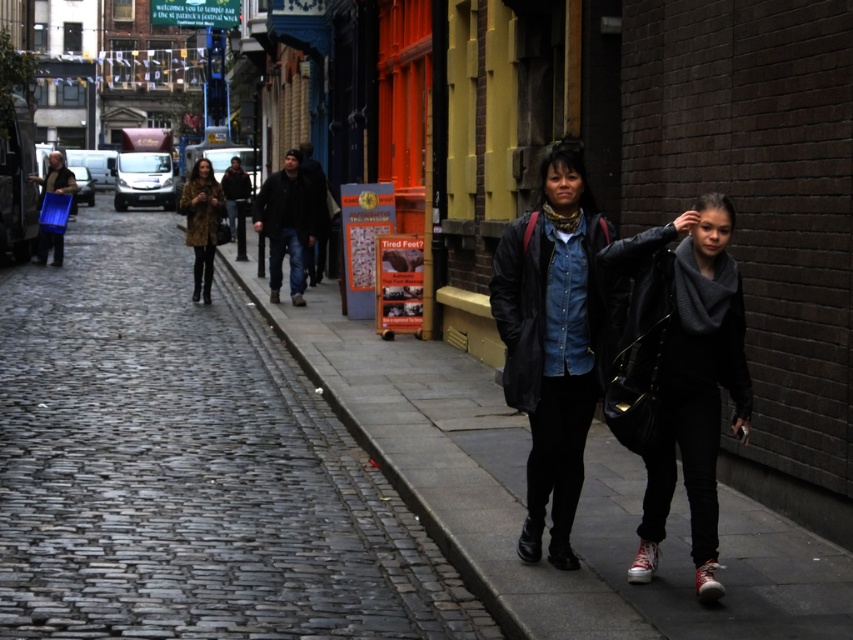
You are a photographer standing at the edge of the street. You notice two items at the center of your viewfinder, the dark blue jeans at center and the dark brown leather jacket at center. Which item appears shorter in your frame?

The dark blue jeans at center appears shorter than the dark brown leather jacket at center in the frame.

You are a street artist planning to paint a mural on the wall behind the dark blue jeans at center and dark brown leather jacket at center. Since you want to ensure the mural will be visible above both, which object should you position the top of the mural above?

The dark brown leather jacket at center is above the dark blue jeans at center, so the top of the mural should be positioned above the dark brown leather jacket at center to ensure visibility above both.